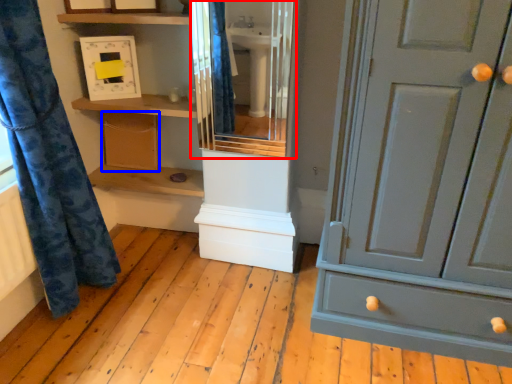
Question: Which of the following is the farthest to the observer, cabinet (highlighted by a red box) or cabinetry (highlighted by a blue box)?

Choices:
 (A) cabinet
 (B) cabinetry

Answer: (B)